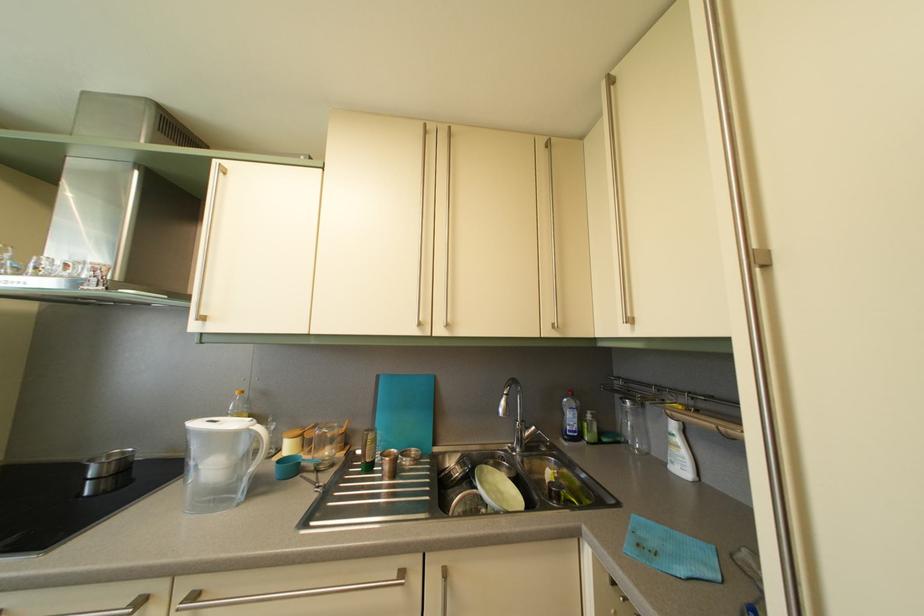
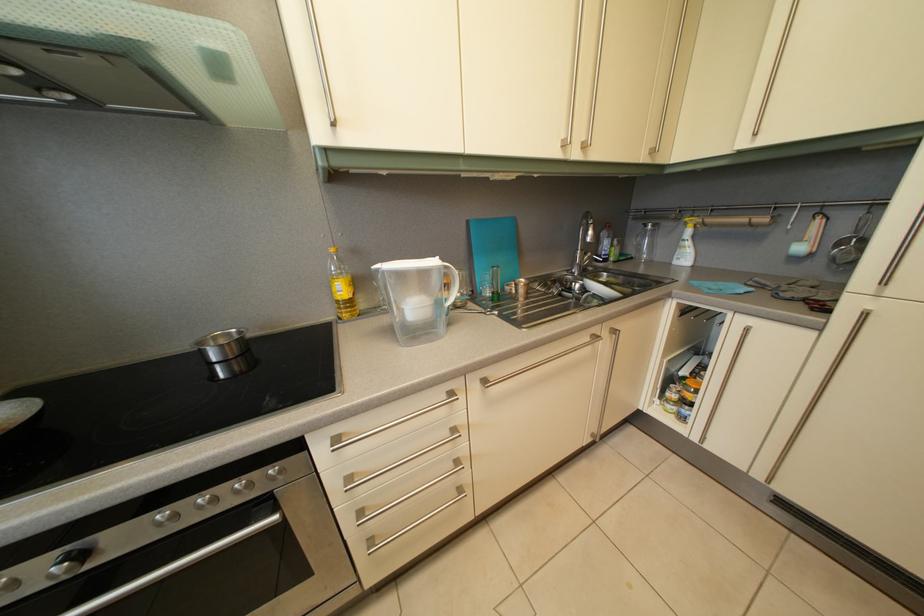
Find the pixel in the second image that matches point 118,463 in the first image.

(224, 346)